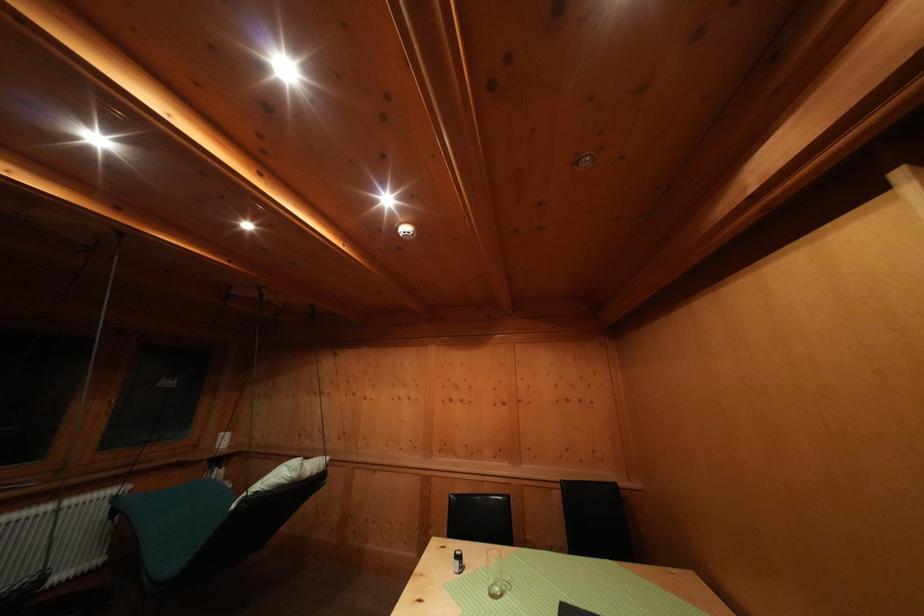
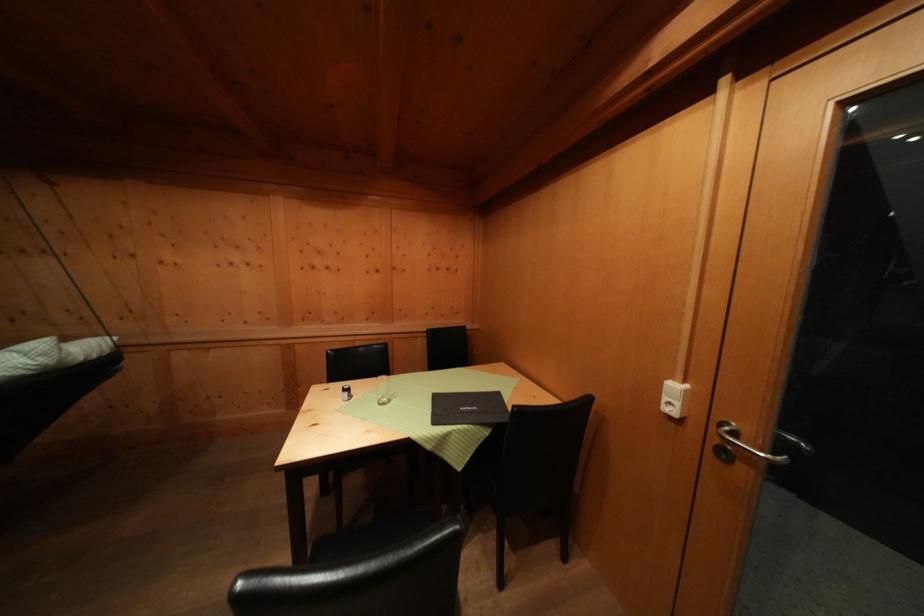
Locate, in the second image, the point that corresponds to (x=463, y=562) in the first image.

(350, 395)